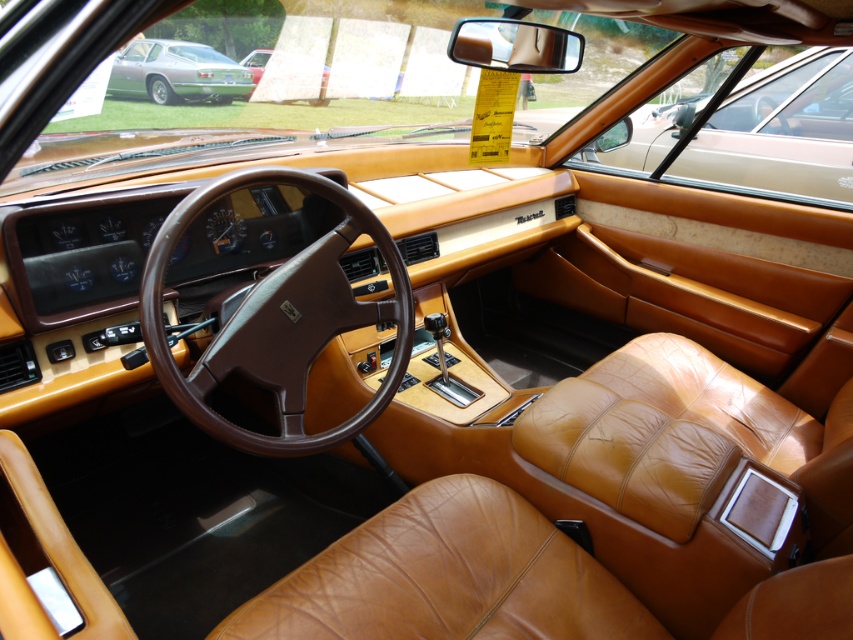
Question: Which object appears farthest from the camera in this image?

Choices:
 (A) green matte sports car at upper left
 (B) tan leather door at upper right

Answer: (A)

Question: Where is tan leather door at upper right located in relation to matte red car at upper center in the image?

Choices:
 (A) left
 (B) right

Answer: (B)

Question: Which object is positioned closest to the matte red car at upper center?

Choices:
 (A) green matte sports car at upper left
 (B) tan leather door at upper right

Answer: (A)

Question: Based on their relative distances, which object is nearer to the green matte sports car at upper left?

Choices:
 (A) brown leather steering wheel at center
 (B) matte red car at upper center

Answer: (B)

Question: Is tan leather door at upper right further to camera compared to green matte sports car at upper left?

Choices:
 (A) yes
 (B) no

Answer: (B)

Question: Is brown leather steering wheel at center thinner than matte red car at upper center?

Choices:
 (A) no
 (B) yes

Answer: (A)